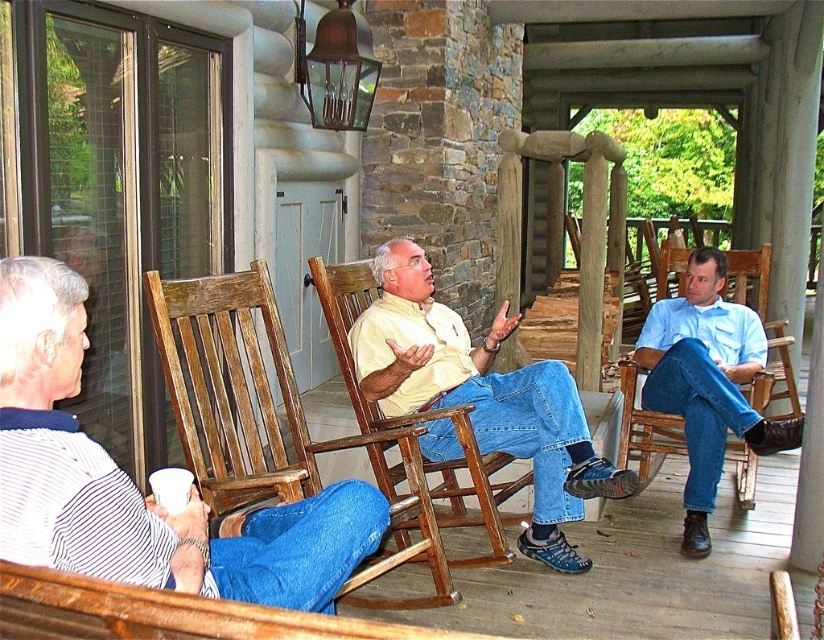
Which is behind, point (69, 355) or point (661, 396)?

Positioned behind is point (661, 396).

Between striped cotton shirt at left and light blue shirt at right, which one appears on the right side from the viewer's perspective?

light blue shirt at right

This screenshot has width=824, height=640. In order to click on striped cotton shirt at left in this screenshot , I will do `click(134, 486)`.

This screenshot has height=640, width=824. In order to click on striped cotton shirt at left in this screenshot , I will do `click(134, 486)`.

Does matte yellow shirt at center appear on the left side of light blue shirt at right?

Correct, you'll find matte yellow shirt at center to the left of light blue shirt at right.

Who is more distant from viewer, (387, 284) or (698, 394)?

Positioned behind is point (698, 394).

Locate an element on the screen. Image resolution: width=824 pixels, height=640 pixels. matte yellow shirt at center is located at coordinates (481, 396).

Can you confirm if striped cotton shirt at left is shorter than matte yellow shirt at center?

Correct, striped cotton shirt at left is not as tall as matte yellow shirt at center.

Is striped cotton shirt at left smaller than matte yellow shirt at center?

Yes, striped cotton shirt at left is smaller than matte yellow shirt at center.

This screenshot has width=824, height=640. Identify the location of striped cotton shirt at left. (134, 486).